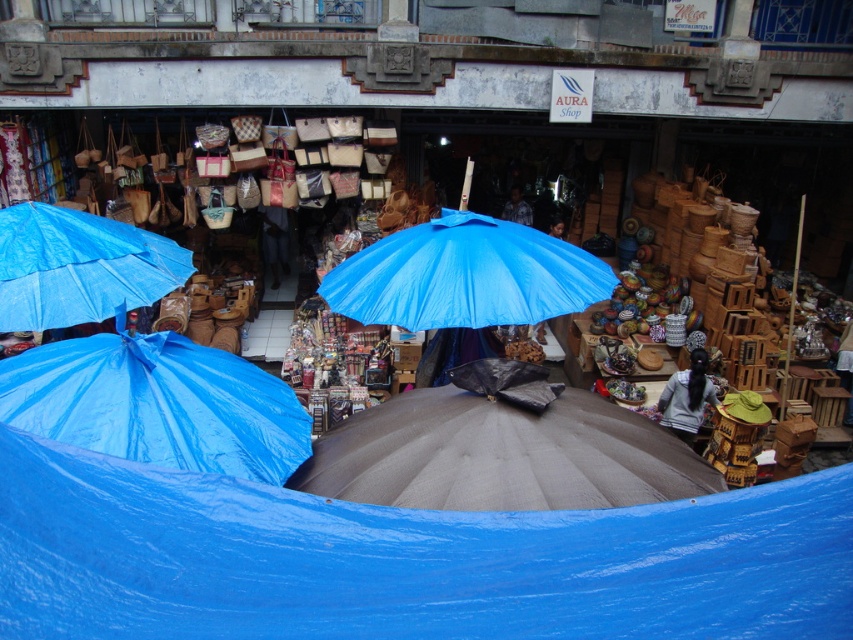
Based on the photo, you are standing at the entrance of the market and see two points marked in the image. The first point is at coordinate point(614, 490) and the second is at point(13, 374). Which point is closer to you?

Point(614, 490) is in front of point(13, 374), so the first point is closer to you.

You are setting up a stall at the market and have both the blue tarp at center and the gray fabric umbrella at center. If you want to cover a wide area, which item should you choose?

The blue tarp at center has a larger width than the gray fabric umbrella at center, so it would be better to choose the blue tarp at center to cover a wider area.

You are a customer at the market and want to know which umbrella is shorter between the gray fabric umbrella at center and the blue tarpaulin umbrella at center. Can you tell me?

The gray fabric umbrella at center has a lesser height compared to the blue tarpaulin umbrella at center, so the gray fabric umbrella at center is shorter.